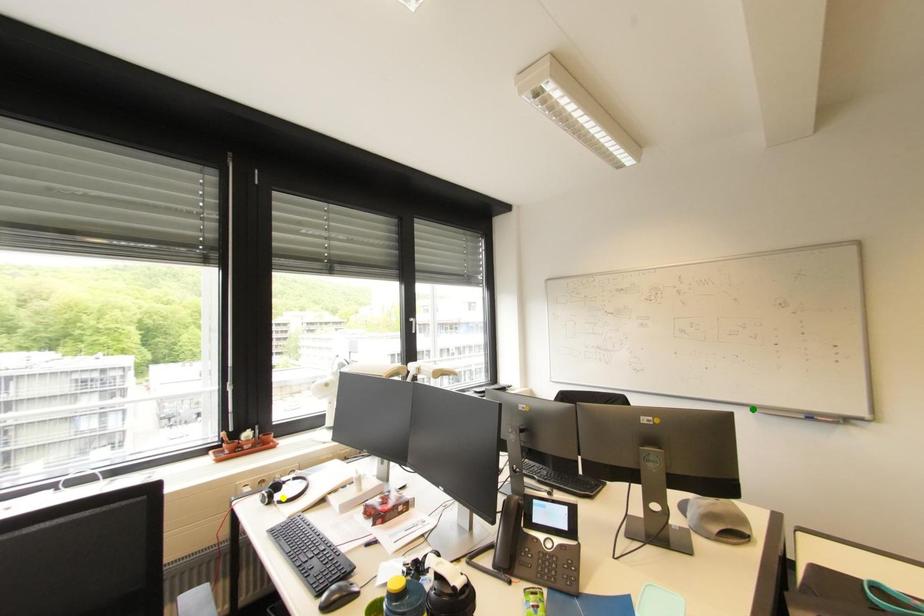
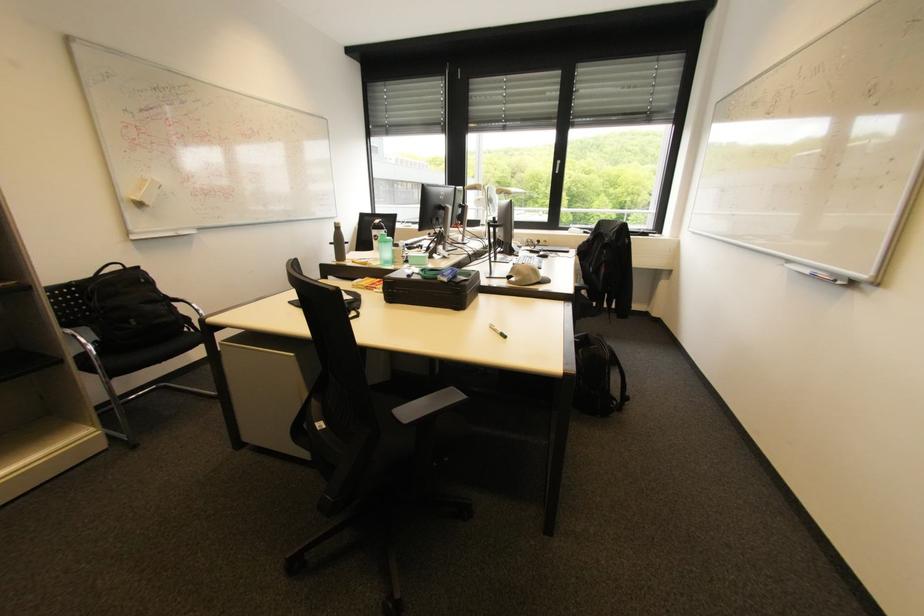
I am providing you with two images of the same scene from different viewpoints. Three points are marked in image1. Which point corresponds to a part or object that is occluded in image2?In image1, three points are marked. Which of them correspond to a part or object that is occluded in image2?Among the three points shown in image1, which one corresponds to a part or object that is no longer visible due to occlusion in image2?

yellow point cannot be seen in image2.